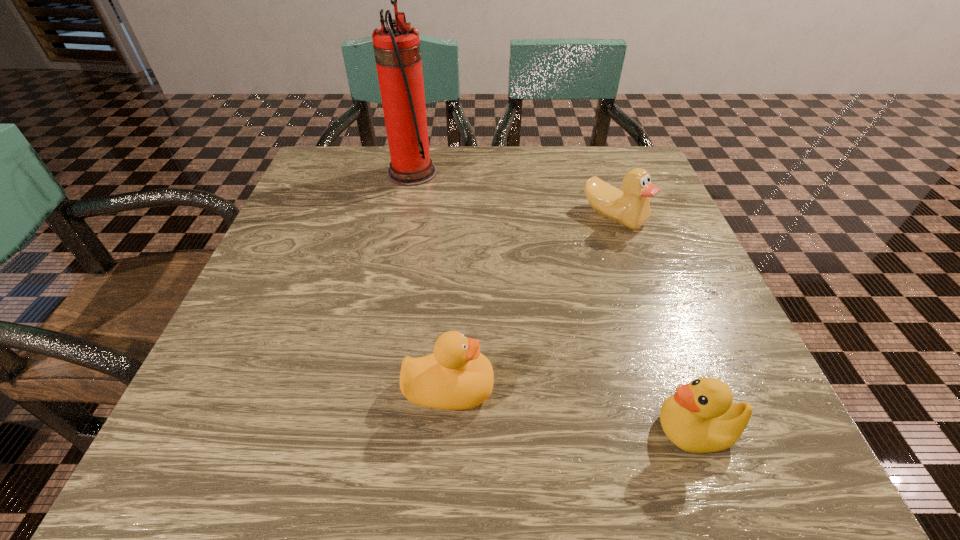
Find the location of `free space that is in between the leftmost duck and the farthest object`. free space that is in between the leftmost duck and the farthest object is located at coordinates (430, 280).

The height and width of the screenshot is (540, 960). What are the coordinates of `object that is the second nearest to the third nearest object` in the screenshot? It's located at pyautogui.click(x=456, y=376).

Find the location of a particular element. The image size is (960, 540). object that is the third nearest to the fire extinguisher is located at coordinates (701, 417).

Locate an element on the screen. This screenshot has height=540, width=960. duck identified as the closest to the farthest object is located at coordinates pos(630,208).

Select which duck is the second closest to the leftmost duck. Please provide its 2D coordinates. Your answer should be formatted as a tuple, i.e. [(x, y)], where the tuple contains the x and y coordinates of a point satisfying the conditions above.

[(630, 208)]

The height and width of the screenshot is (540, 960). In order to click on vacant space that satisfies the following two spatial constraints: 1. at the beak of the farthest duck; 2. on the face of the leftmost duck in this screenshot , I will do `click(674, 388)`.